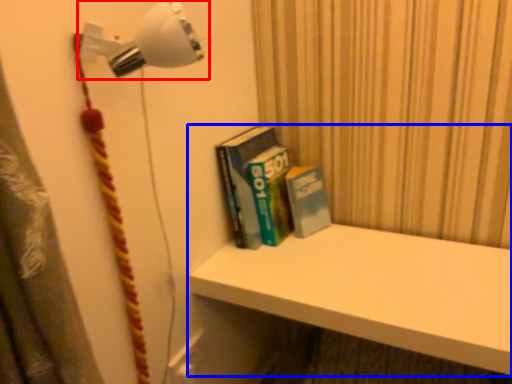
Question: Which object appears closest to the camera in this image, lamp (highlighted by a red box) or shelf (highlighted by a blue box)?

Choices:
 (A) lamp
 (B) shelf

Answer: (A)